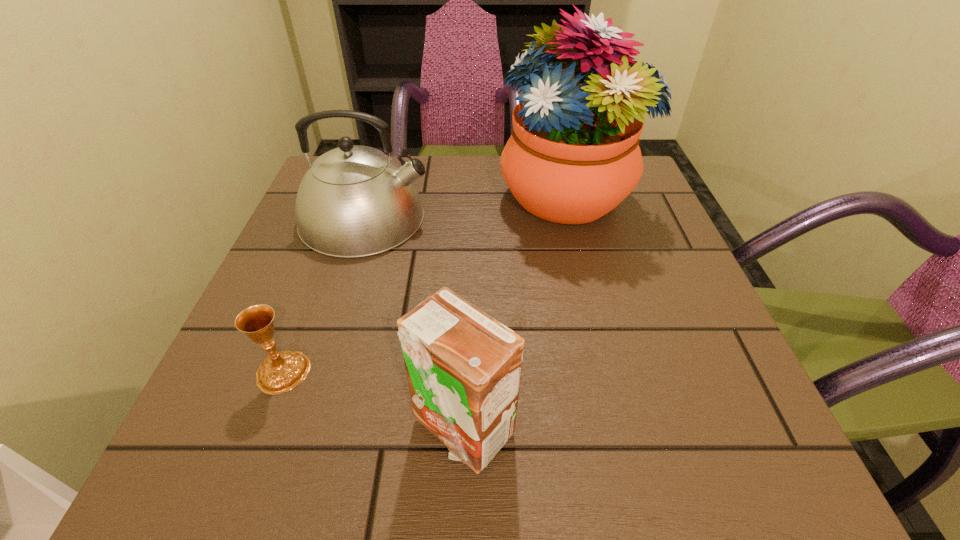
This screenshot has height=540, width=960. What are the coordinates of `flower arrangement` in the screenshot? It's located at (573, 156).

At what (x,y) coordinates should I click in order to perform the action: click on kettle. Please return your answer as a coordinate pair (x, y). Looking at the image, I should click on (354, 201).

Locate an element on the screen. This screenshot has width=960, height=540. carton is located at coordinates (463, 367).

At what (x,y) coordinates should I click in order to perform the action: click on chalice. Please return your answer as a coordinate pair (x, y). The height and width of the screenshot is (540, 960). Looking at the image, I should click on (279, 372).

The image size is (960, 540). In order to click on vacant space located on the front of the flower arrangement in this screenshot , I will do `click(593, 291)`.

You are a GUI agent. You are given a task and a screenshot of the screen. Output one action in this format:
    pyautogui.click(x=<x>, y=<y>)
    Task: Click on the free region located 0.250m from the spout of the kettle
    Image resolution: width=960 pixels, height=540 pixels.
    Given the screenshot: What is the action you would take?
    pyautogui.click(x=543, y=218)

Find the location of a particular element. blank space located on the back of the shortest object is located at coordinates (343, 214).

At what (x,y) coordinates should I click in order to perform the action: click on flower arrangement present at the far edge. Please return your answer as a coordinate pair (x, y). Looking at the image, I should click on (573, 156).

This screenshot has width=960, height=540. I want to click on kettle situated at the far edge, so click(x=354, y=201).

This screenshot has height=540, width=960. I want to click on object that is at the near edge, so click(463, 367).